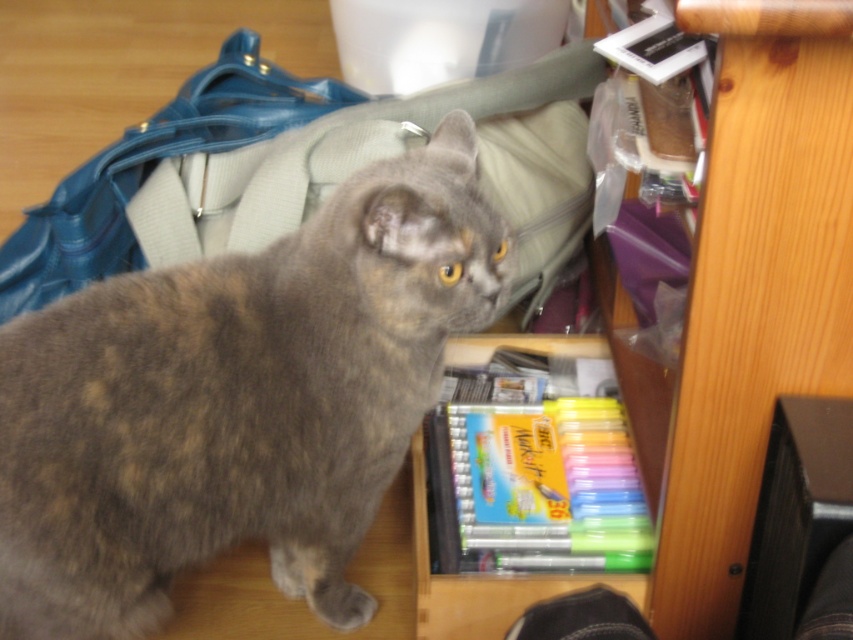
Question: Observing the image, what is the correct spatial positioning of gray fur cat at center in reference to wooden bookshelf at center?

Choices:
 (A) above
 (B) below

Answer: (B)

Question: Among these objects, which one is nearest to the camera?

Choices:
 (A) leather-like blue bag at center
 (B) gray fur cat at center
 (C) wooden bookshelf at center
 (D) black plastic speaker at lower right

Answer: (C)

Question: Which object is the farthest from the gray fur cat at center?

Choices:
 (A) black plastic speaker at lower right
 (B) wooden bookshelf at center
 (C) leather-like blue bag at center

Answer: (A)

Question: Which object is closer to the camera taking this photo?

Choices:
 (A) gray fur cat at center
 (B) wooden bookshelf at center
 (C) leather-like blue bag at center
 (D) black plastic speaker at lower right

Answer: (B)

Question: Does leather-like blue bag at center have a lesser width compared to black plastic speaker at lower right?

Choices:
 (A) yes
 (B) no

Answer: (B)

Question: Does gray fur cat at center have a smaller size compared to black plastic speaker at lower right?

Choices:
 (A) no
 (B) yes

Answer: (A)